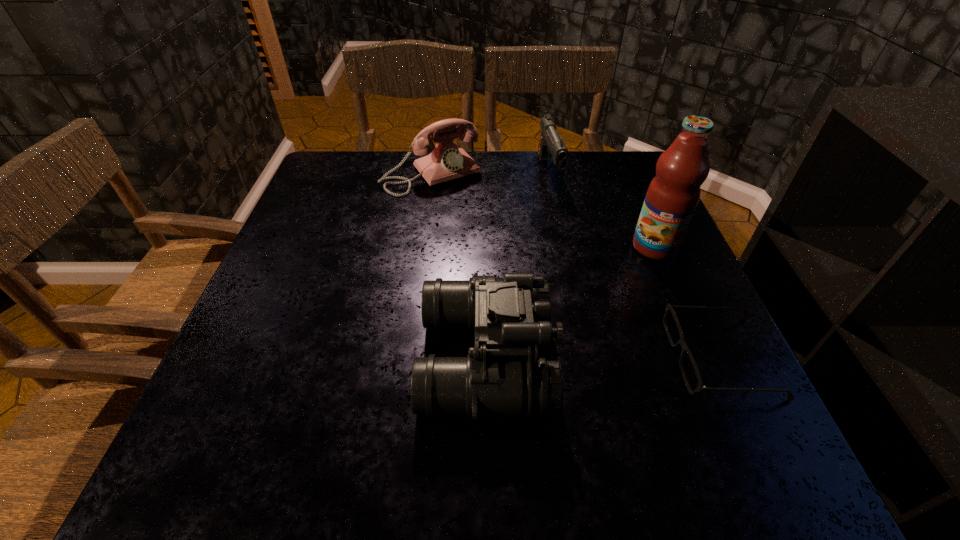
Find the location of a particular element. The height and width of the screenshot is (540, 960). free area in between the spectacles and the third object from right to left is located at coordinates (635, 264).

You are a GUI agent. You are given a task and a screenshot of the screen. Output one action in this format:
    pyautogui.click(x=<x>, y=<y>)
    Task: Click on the free space between the telephone and the tallest object
    
    Given the screenshot: What is the action you would take?
    pyautogui.click(x=543, y=211)

The height and width of the screenshot is (540, 960). I want to click on vacant region between the shortest object and the fruit juice, so click(x=687, y=302).

At what (x,y) coordinates should I click in order to perform the action: click on object identified as the closest to the binoculars. Please return your answer as a coordinate pair (x, y). This screenshot has height=540, width=960. Looking at the image, I should click on (700, 387).

Point out which object is positioned as the third nearest to the third nearest object. Please provide its 2D coordinates. Your answer should be formatted as a tuple, i.e. [(x, y)], where the tuple contains the x and y coordinates of a point satisfying the conditions above.

[(508, 379)]

This screenshot has height=540, width=960. Identify the location of vacant position in the image that satisfies the following two spatial constraints: 1. on the front side of the tallest object; 2. on the front-facing side of the spectacles. (701, 357).

The image size is (960, 540). In order to click on vacant space that satisfies the following two spatial constraints: 1. on the front side of the shortest object; 2. on the front-facing side of the telephone in this screenshot , I will do `click(406, 357)`.